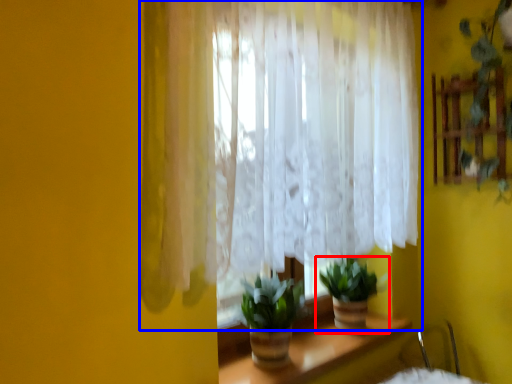
Question: Which object appears farthest to the camera in this image, houseplant (highlighted by a red box) or curtain (highlighted by a blue box)?

Choices:
 (A) houseplant
 (B) curtain

Answer: (A)